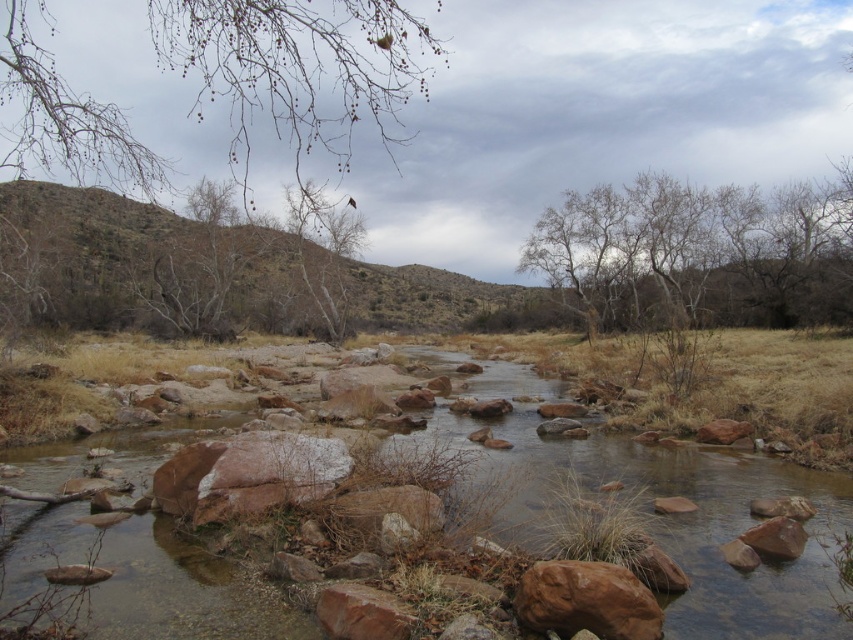
Is point (699, 268) positioned before point (631, 616)?

That is False.

Is bare branches at upper right wider than brown rough rock at lower right?

Yes.

Identify the location of bare branches at upper right. (699, 252).

Locate an element on the screen. bare branches at upper right is located at coordinates (699, 252).

In the scene shown: Is brown rock stream at center smaller than brown rough rock at lower right?

Actually, brown rock stream at center might be larger than brown rough rock at lower right.

Who is more forward, (54, 538) or (614, 637)?

Point (614, 637) is more forward.

Identify the location of brown rock stream at center. The height and width of the screenshot is (640, 853). (653, 516).

Is brown rough rock at lower right positioned in front of reddish-brown rock at lower center?

No.

Measure the distance between brown rough rock at lower right and camera.

A distance of 17.11 feet exists between brown rough rock at lower right and camera.

This screenshot has height=640, width=853. What do you see at coordinates (585, 600) in the screenshot?
I see `brown rough rock at lower right` at bounding box center [585, 600].

Find the location of a particular element. The image size is (853, 640). brown rough rock at lower right is located at coordinates (585, 600).